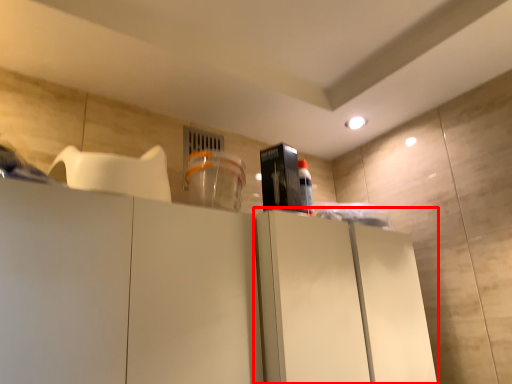
Question: Observing the image, what is the correct spatial positioning of cabinetry (annotated by the red box) in reference to appliance?

Choices:
 (A) right
 (B) left

Answer: (A)